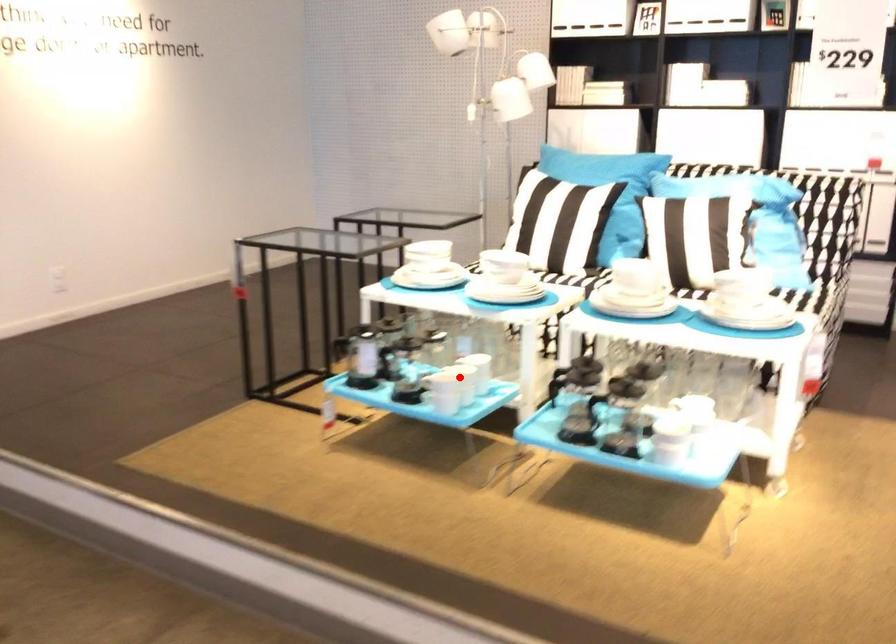
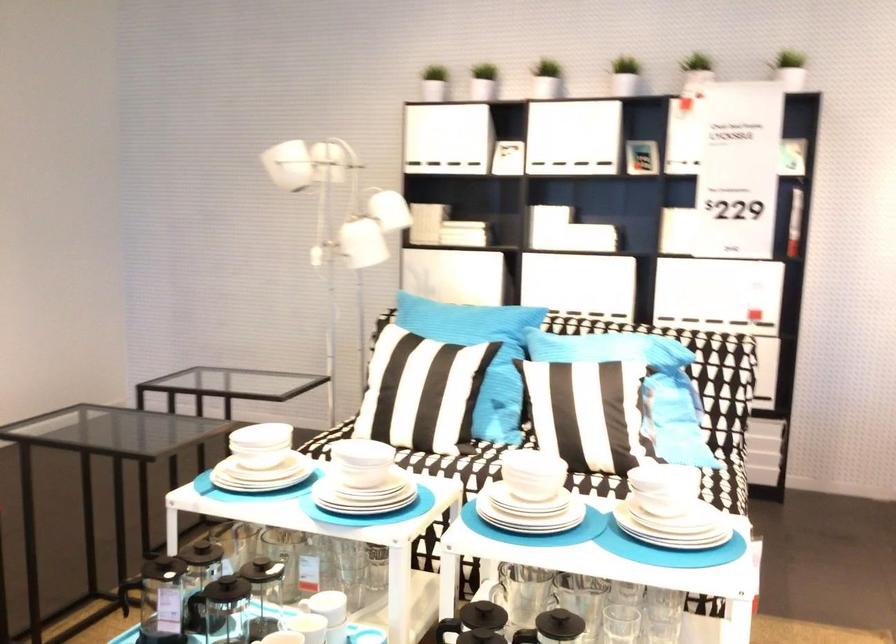
In the second image, find the point that corresponds to the highlighted location in the first image.

(304, 629)